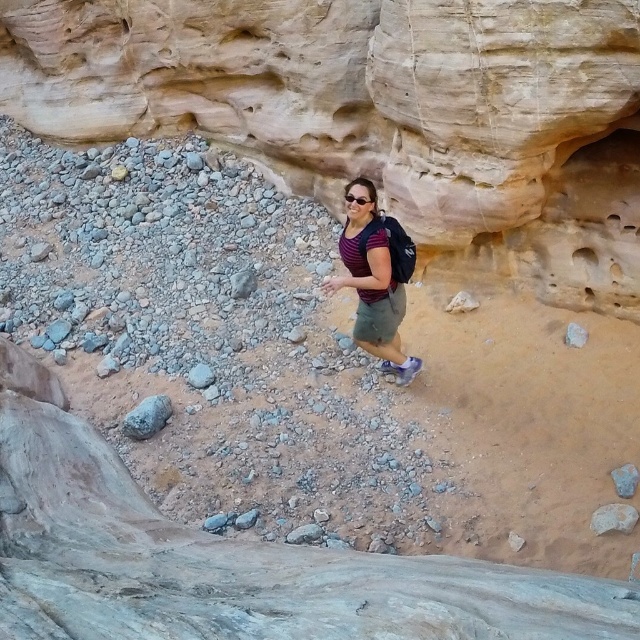
You are a photographer standing at the edge of the canyon, and you want to take a photo of the striped fabric shirt at center and the gray rock at lower right. Which object should you focus on first if you want both to be in sharp focus?

The gray rock at lower right is behind the striped fabric shirt at center, so you should focus on the gray rock at lower right first to ensure both are in sharp focus.

You are a photographer trying to capture a photo of the striped fabric shirt at center and the gray rock at lower right. If you want to ensure both subjects are fully visible in the frame, which subject should you focus on first to avoid cropping the wider object?

The striped fabric shirt at center is wider than the gray rock at lower right, so you should focus on the striped fabric shirt at center first to ensure it fits in the frame without cropping.